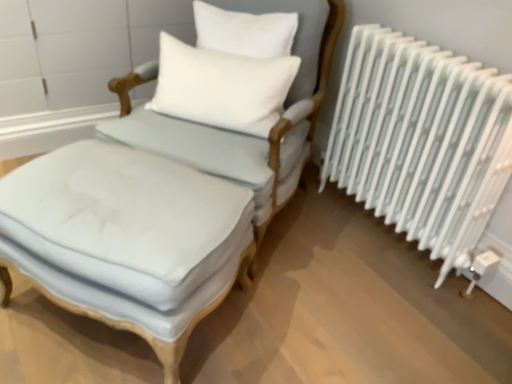
This screenshot has height=384, width=512. What are the coordinates of `vacant area that is in front of white metal radiator at right` in the screenshot? It's located at (391, 311).